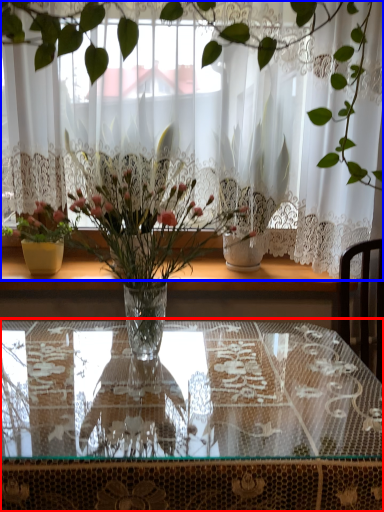
Question: Which object appears farthest to the camera in this image, table (highlighted by a red box) or curtain (highlighted by a blue box)?

Choices:
 (A) table
 (B) curtain

Answer: (B)